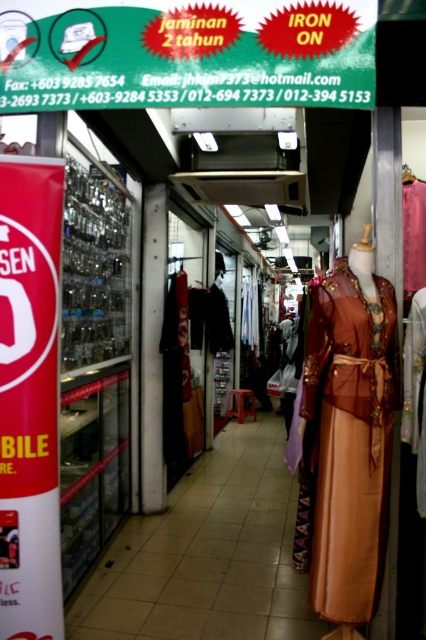
Describe the element at coordinates (186, 52) in the screenshot. I see `red glossy iron at upper center` at that location.

I want to click on red glossy iron at upper center, so click(x=186, y=52).